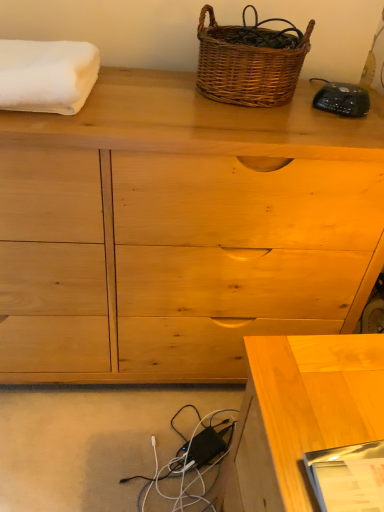
Where is `free spot in front of black plastic remote at upper right`? This screenshot has width=384, height=512. free spot in front of black plastic remote at upper right is located at coordinates (324, 136).